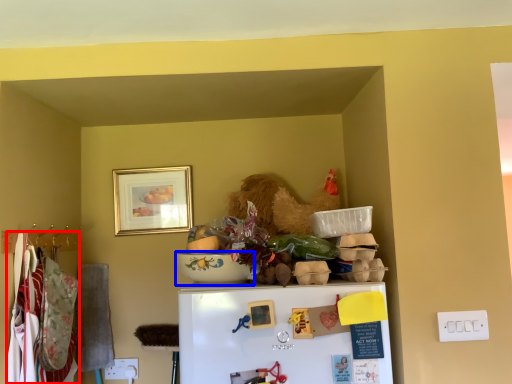
Question: Which point is further to the camera, laundry (highlighted by a red box) or bowl (highlighted by a blue box)?

Choices:
 (A) laundry
 (B) bowl

Answer: (A)